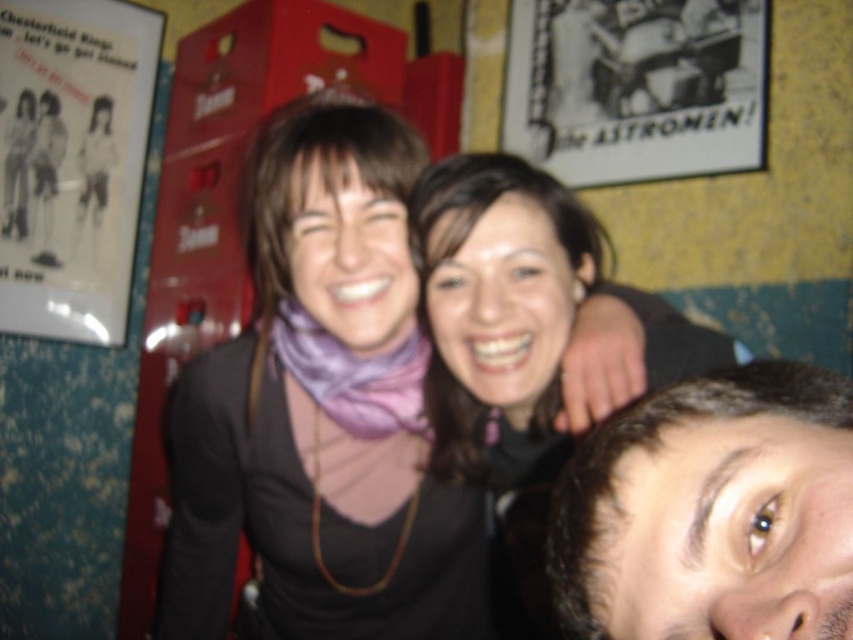
You are taking a photo of two women at a social gathering. You want to focus on the woman at point (838, 492) and the woman at point (520, 324). Which woman is closer to the camera?

The woman at point (838, 492) is closer to the camera than the woman at point (520, 324).

You are at a social event and notice two items in the scene. One is the brown hair at upper right and the other is the matte black sweater at center. Which of these is positioned higher from the ground?

The brown hair at upper right is positioned higher from the ground than the matte black sweater at center because it is described as being above it.

You are a photographer trying to capture a candid shot of the two women in the scene. You want to ensure that both the brown hair at upper right and the matte black sweater at center are in focus. Given that your camera has a depth of field that can cover 16 inches, will you be able to achieve this?

The distance between the brown hair at upper right and the matte black sweater at center is 15.59 inches, which is within the camera lens depth of field of 16 inches. Therefore, both subjects can be in focus.